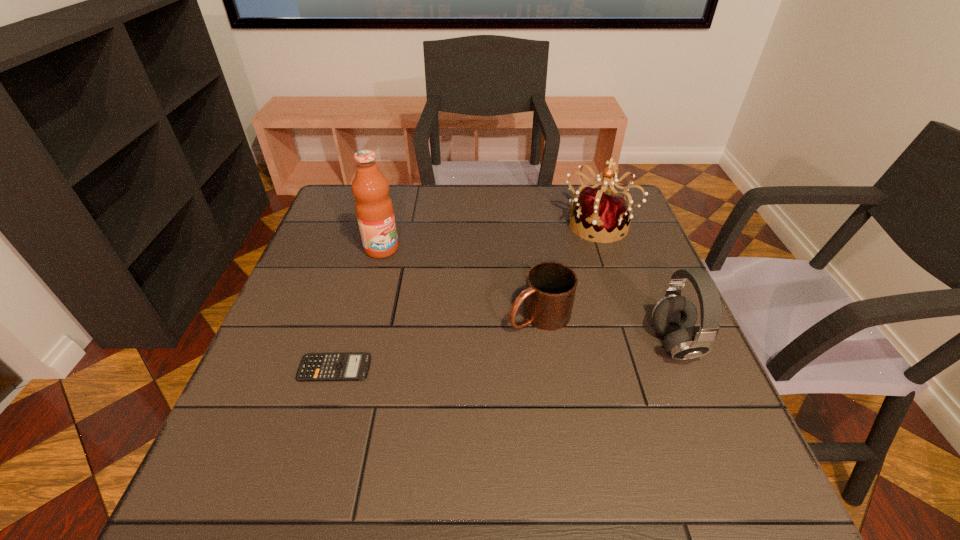
The height and width of the screenshot is (540, 960). I want to click on free space between the calculator and the tallest object, so pyautogui.click(x=358, y=308).

Identify the location of free spot between the calculator and the second shortest object. (437, 342).

Where is `free point between the fourth tallest object and the headset`? The image size is (960, 540). free point between the fourth tallest object and the headset is located at coordinates (607, 329).

At what (x,y) coordinates should I click in order to perform the action: click on empty space that is in between the calculator and the headset. Please return your answer as a coordinate pair (x, y). Looking at the image, I should click on (505, 356).

Identify the location of vacant region between the calculator and the mug. (437, 342).

Locate an element on the screen. unoccupied position between the mug and the fruit juice is located at coordinates (460, 282).

Locate an element on the screen. the closest object relative to the calculator is located at coordinates (549, 294).

Where is `object that is the third nearest to the shortest object`? The height and width of the screenshot is (540, 960). object that is the third nearest to the shortest object is located at coordinates (674, 316).

Locate an element on the screen. Image resolution: width=960 pixels, height=540 pixels. free region that satisfies the following two spatial constraints: 1. on the front side of the tiara; 2. on the ear cups of the headset is located at coordinates (638, 343).

Image resolution: width=960 pixels, height=540 pixels. In order to click on free spot that satisfies the following two spatial constraints: 1. on the back side of the fruit juice; 2. on the left side of the tiara in this screenshot , I will do `click(388, 224)`.